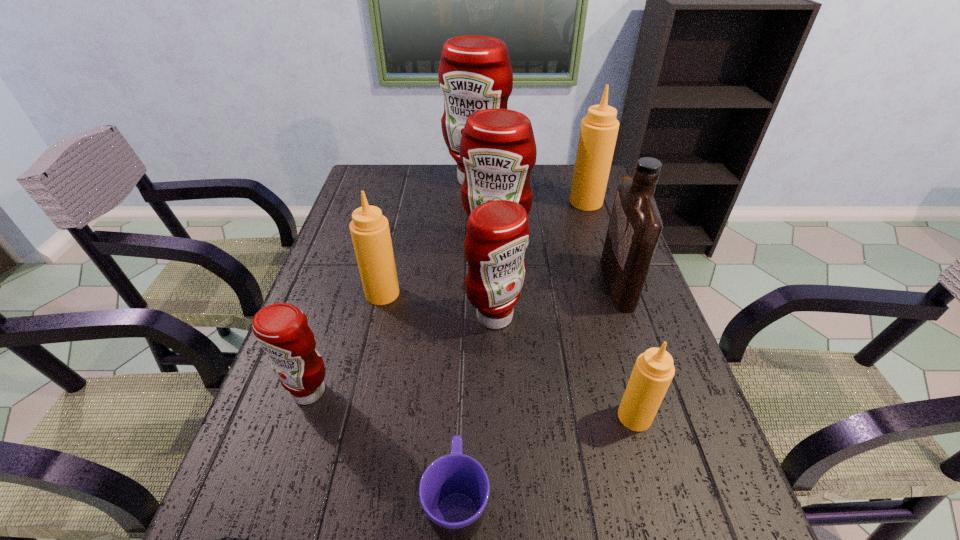
Locate an element on the screen. free spot between the biggest red condiment and the smallest tan condiment is located at coordinates (555, 299).

Where is `vacant space that's between the biggest tan condiment and the liquor`? The image size is (960, 540). vacant space that's between the biggest tan condiment and the liquor is located at coordinates (602, 242).

In order to click on free space between the smallest tan condiment and the nearest red condiment in this screenshot , I will do `click(472, 404)`.

What are the coordinates of `object that stands as the fifth closest to the second nearest red condiment` in the screenshot? It's located at (282, 330).

Where is `object that ranks as the fourth closest to the nearest object`? This screenshot has height=540, width=960. object that ranks as the fourth closest to the nearest object is located at coordinates (369, 229).

This screenshot has width=960, height=540. I want to click on condiment that is the seventh closest to the second nearest object, so click(x=475, y=73).

Identify which condiment is the second nearest to the leftmost condiment. Please provide its 2D coordinates. Your answer should be formatted as a tuple, i.e. [(x, y)], where the tuple contains the x and y coordinates of a point satisfying the conditions above.

[(498, 233)]

You are a GUI agent. You are given a task and a screenshot of the screen. Output one action in this format:
    pyautogui.click(x=<x>, y=<y>)
    Task: Click on the red condiment that is the third closest to the third nearest red condiment
    
    Given the screenshot: What is the action you would take?
    pyautogui.click(x=282, y=330)

This screenshot has width=960, height=540. Identify the location of the third closest red condiment to the farthest tan condiment. (498, 233).

Select which tan condiment is the second closest to the smallest red condiment. Please provide its 2D coordinates. Your answer should be formatted as a tuple, i.e. [(x, y)], where the tuple contains the x and y coordinates of a point satisfying the conditions above.

[(653, 371)]